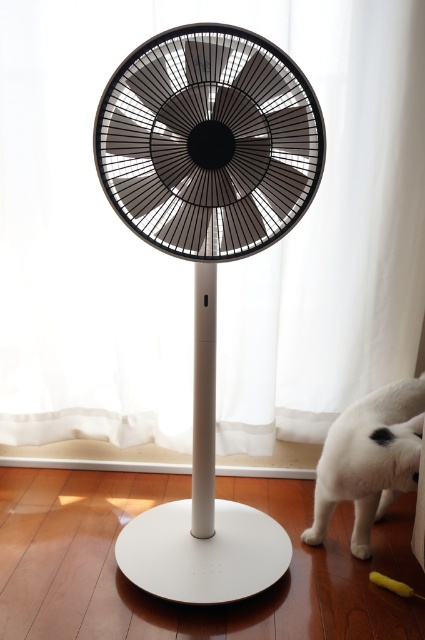
Can you confirm if black matte fan at center is positioned below white fur cat at lower right?

Actually, black matte fan at center is above white fur cat at lower right.

Does black matte fan at center have a larger size compared to white fur cat at lower right?

Indeed, black matte fan at center has a larger size compared to white fur cat at lower right.

Between point (277, 81) and point (325, 483), which one is positioned behind?

The point (325, 483) is more distant.

Identify the location of black matte fan at center. The image size is (425, 640). pos(206,257).